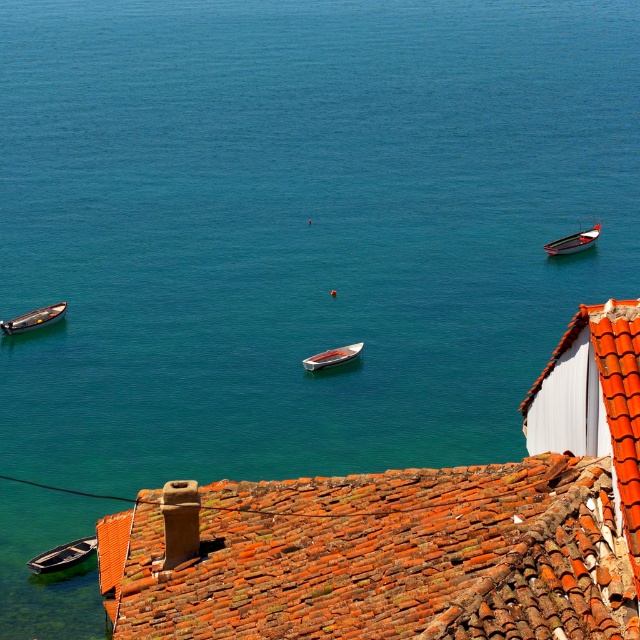
You are a bird flying over the coastal scene. You want to land on the highest point between the rusty clay tiles at center and the wooden boat at center. Which one should you choose?

The rusty clay tiles at center has a greater height compared to the wooden boat at center, so you should choose the rusty clay tiles at center to land on.

You are a delivery drone with a wingspan of 1.5 meters. You need to fly between the wooden boat at lower left and the metallic red boat at right. Can you safely pass through the space between them without touching either boat?

The wooden boat at lower left and metallic red boat at right are 50.21 meters apart from each other. Since your wingspan is only 1.5 meters, there is more than enough space for you to safely pass between them without any issues.

You are a tourist standing on the beach and looking at the rusty clay tiles at center and the wooden boat at left. Which object is closer to the water?

The wooden boat at left is closer to the water because the rusty clay tiles at center are located below it, meaning the boat is positioned higher up relative to the water.